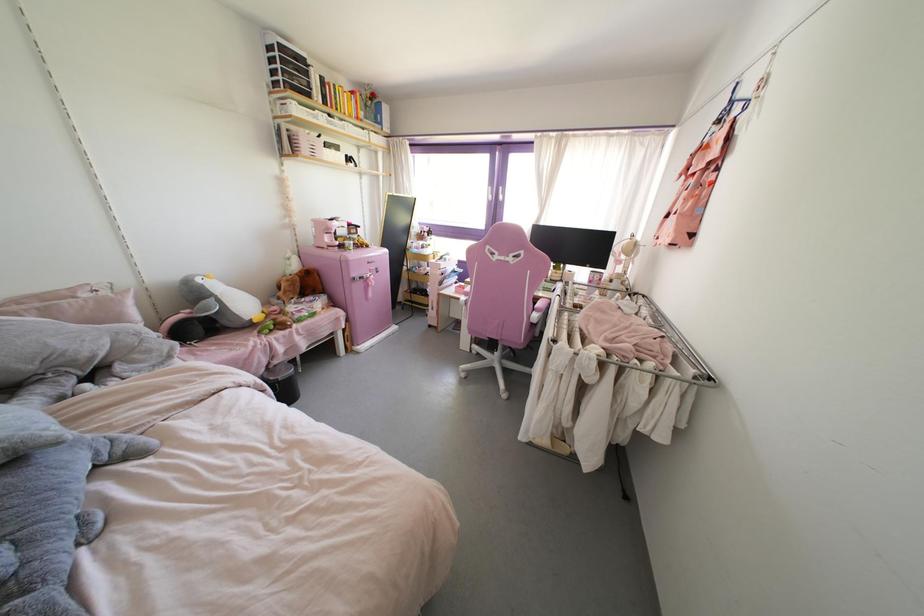
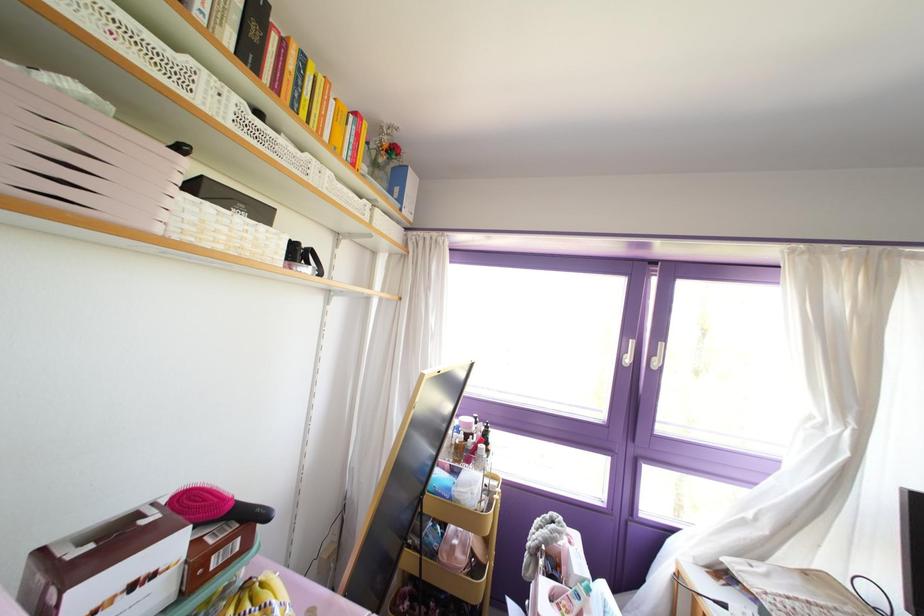
The point at (489, 197) is marked in the first image. Where is the corresponding point in the second image?

(626, 360)